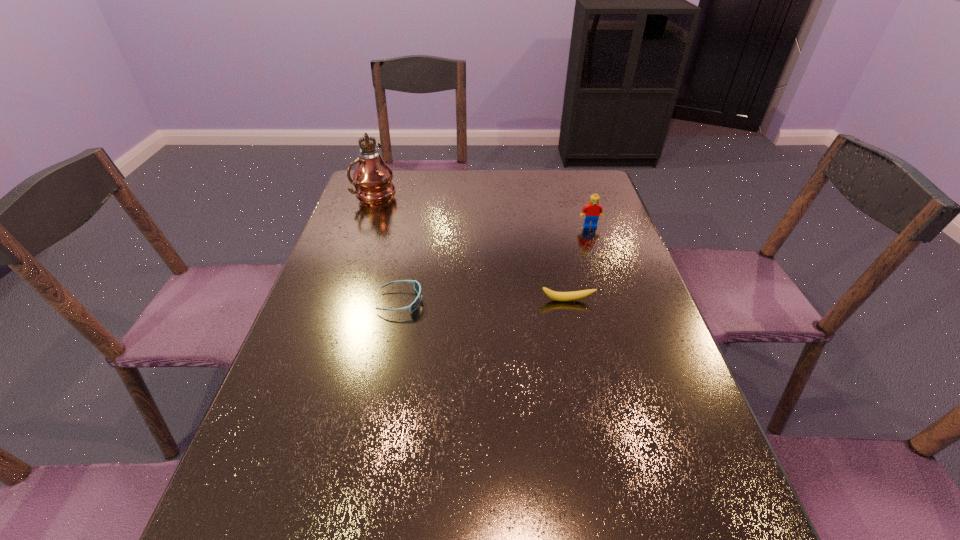
The height and width of the screenshot is (540, 960). Find the location of `vacant space situated on the upward curve of the second object from right to left`. vacant space situated on the upward curve of the second object from right to left is located at coordinates (578, 353).

Where is `vacant region located 0.330m on the front-facing side of the goggles`? The image size is (960, 540). vacant region located 0.330m on the front-facing side of the goggles is located at coordinates (x=553, y=301).

At what (x,y) coordinates should I click in order to perform the action: click on object at the far edge. Please return your answer as a coordinate pair (x, y). The image size is (960, 540). Looking at the image, I should click on (372, 177).

This screenshot has width=960, height=540. Find the location of `object positioned at the left edge`. object positioned at the left edge is located at coordinates (372, 177).

Find the location of `Lego that is at the right edge`. Lego that is at the right edge is located at coordinates (593, 210).

Image resolution: width=960 pixels, height=540 pixels. In order to click on banana that is at the right edge in this screenshot , I will do `click(575, 295)`.

Find the location of `object at the far left corner`. object at the far left corner is located at coordinates (372, 177).

This screenshot has width=960, height=540. Identify the location of vacant space at the far edge. (458, 175).

In the image, there is a desktop. Identify the location of vacant space at the left edge. (263, 523).

In the image, there is a desktop. Identify the location of vacant space at the right edge. The height and width of the screenshot is (540, 960). (631, 261).